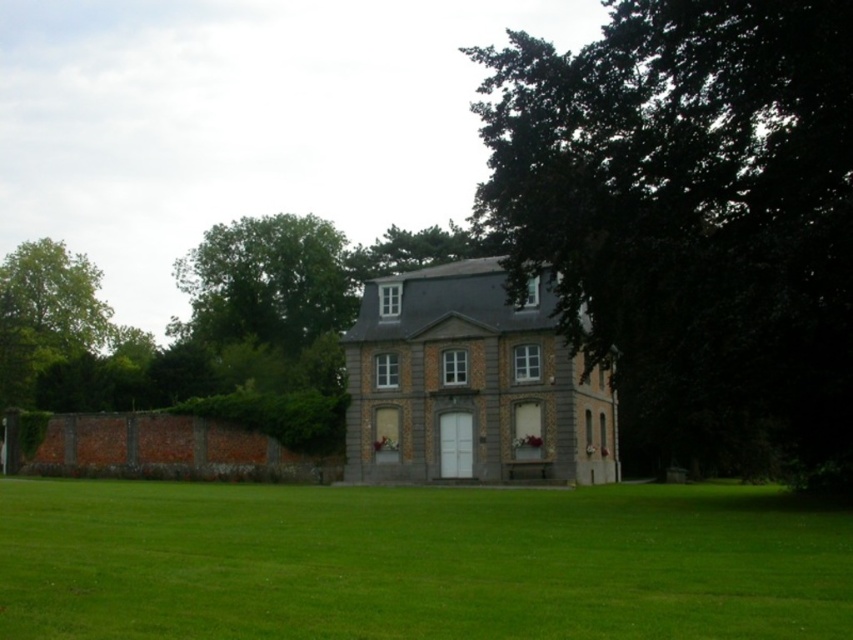
Question: Is the position of dark green leafy tree at upper right more distant than that of green grass at center?

Choices:
 (A) no
 (B) yes

Answer: (B)

Question: Which of the following is the closest to the observer?

Choices:
 (A) green grass at center
 (B) dark green leafy tree at upper right

Answer: (A)

Question: Which point is farther to the camera?

Choices:
 (A) dark green leafy tree at upper right
 (B) green grass at center

Answer: (A)

Question: Is the position of dark green leafy tree at upper right less distant than that of green grass at center?

Choices:
 (A) yes
 (B) no

Answer: (B)

Question: Observing the image, what is the correct spatial positioning of dark green leafy tree at upper right in reference to green grass at center?

Choices:
 (A) above
 (B) below

Answer: (A)